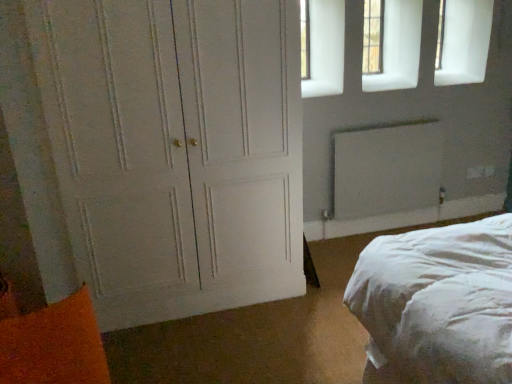
The image size is (512, 384). I want to click on vacant space situated above white matte radiator at upper right (from a real-world perspective), so [379, 123].